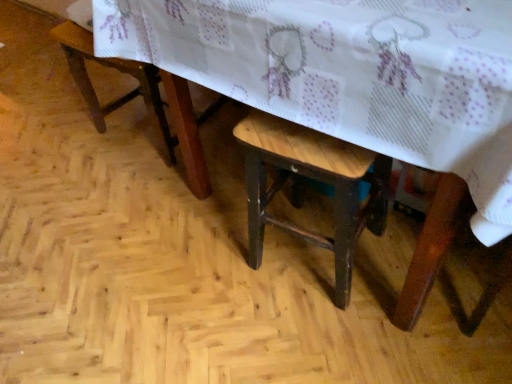
Question: Visually, is wooden stool at lower left positioned to the left or to the right of wooden table at center?

Choices:
 (A) right
 (B) left

Answer: (B)

Question: Looking at the image, does wooden stool at lower left seem bigger or smaller compared to wooden table at center?

Choices:
 (A) big
 (B) small

Answer: (B)

Question: Which is farther from the wooden stool at lower left?

Choices:
 (A) wooden stool at center
 (B) wooden table at center

Answer: (A)

Question: Which object is the closest to the wooden stool at lower left?

Choices:
 (A) wooden table at center
 (B) wooden stool at center

Answer: (A)